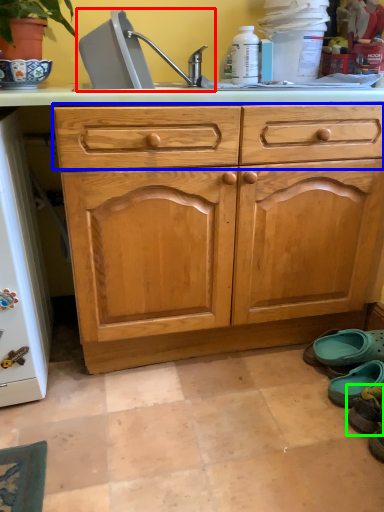
Question: Which object is positioned farthest from sink (highlighted by a red box)? Select from drawer (highlighted by a blue box) and footwear (highlighted by a green box).

Choices:
 (A) drawer
 (B) footwear

Answer: (B)